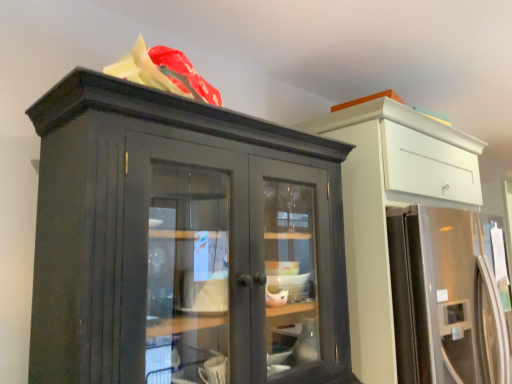
Measure the distance between white glossy cabinet at upper right and camera.

A distance of 1.54 meters exists between white glossy cabinet at upper right and camera.

What do you see at coordinates (376, 219) in the screenshot?
I see `white glossy cabinet at upper right` at bounding box center [376, 219].

Where is `white glossy cabinet at upper right`? The width and height of the screenshot is (512, 384). white glossy cabinet at upper right is located at coordinates (376, 219).

The width and height of the screenshot is (512, 384). Identify the location of white glossy cabinet at upper right. (376, 219).